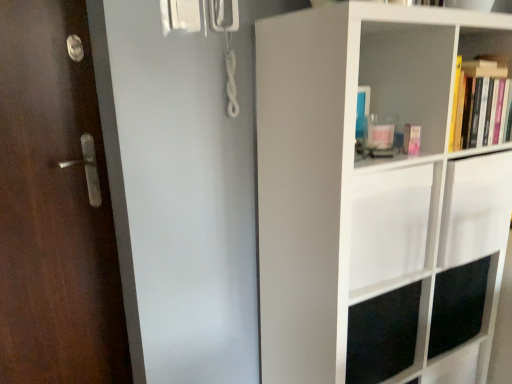
Question: Looking at the image, does white matte shelf at right, positioned as the second shelf in top-to-bottom order, seem bigger or smaller compared to hardcover books at upper right, positioned as the 1th shelf in top-to-bottom order?

Choices:
 (A) big
 (B) small

Answer: (A)

Question: Choose the correct answer: Is white matte shelf at right, positioned as the second shelf in top-to-bottom order, inside hardcover books at upper right, positioned as the 1th shelf in top-to-bottom order, or outside it?

Choices:
 (A) inside
 (B) outside

Answer: (B)

Question: Which object is the farthest from the dark wood door at left?

Choices:
 (A) white matte shelf at right, positioned as the second shelf in top-to-bottom order
 (B) hardcover books at upper right, positioned as the 2th shelf in bottom-to-top order

Answer: (B)

Question: Which of these objects is positioned farthest from the dark wood door at left?

Choices:
 (A) hardcover books at upper right, positioned as the 1th shelf in top-to-bottom order
 (B) white matte shelf at right, positioned as the second shelf in top-to-bottom order

Answer: (A)